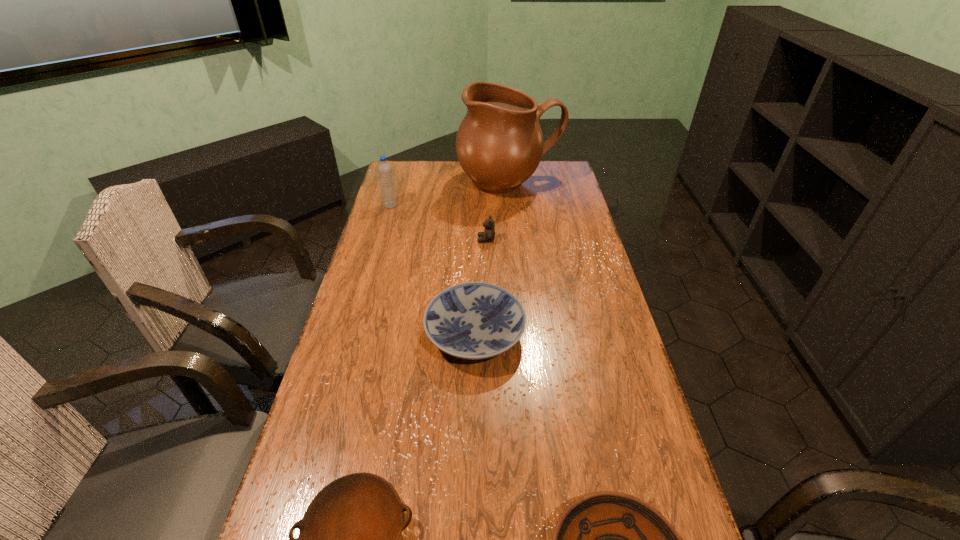
You are a GUI agent. You are given a task and a screenshot of the screen. Output one action in this format:
    pyautogui.click(x=<x>, y=<y>)
    Task: Click on the vacant region located on the face of the third tallest object
    The width and height of the screenshot is (960, 540).
    Given the screenshot: What is the action you would take?
    pyautogui.click(x=431, y=240)

I want to click on blank space located 0.200m on the left of the fourth tallest object, so click(355, 334).

This screenshot has height=540, width=960. I want to click on object that is at the far edge, so click(499, 144).

At what (x,y) coordinates should I click in order to perform the action: click on object located at the left edge. Please return your answer as a coordinate pair (x, y). The image size is (960, 540). Looking at the image, I should click on (384, 169).

Identify the location of object that is at the right edge. (499, 144).

Find the location of a particular element. object located in the far right corner section of the desktop is located at coordinates (499, 144).

Locate an element on the screen. This screenshot has height=540, width=960. vacant area at the left edge of the desktop is located at coordinates (374, 418).

Locate an element on the screen. This screenshot has height=540, width=960. free space at the right edge is located at coordinates (569, 293).

In the image, there is a desktop. Where is `free space at the far left corner`? This screenshot has height=540, width=960. free space at the far left corner is located at coordinates (393, 171).

You are a GUI agent. You are given a task and a screenshot of the screen. Output one action in this format:
    pyautogui.click(x=<x>, y=<y>)
    Task: Click on the vacant space at the far right corner
    The width and height of the screenshot is (960, 540).
    Given the screenshot: What is the action you would take?
    pyautogui.click(x=558, y=176)